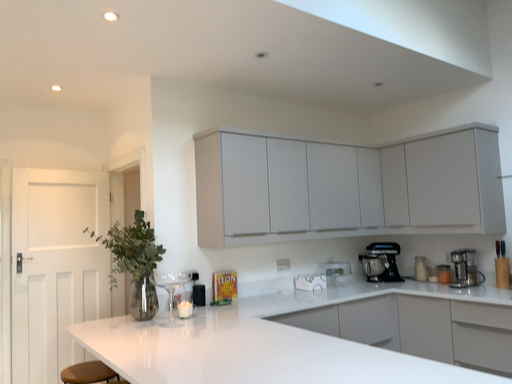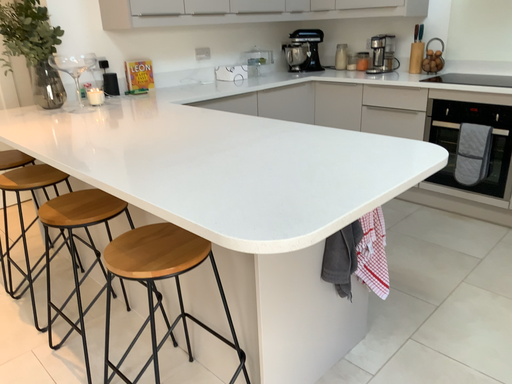
Question: How did the camera likely rotate when shooting the video?

Choices:
 (A) rotated downward
 (B) rotated upward

Answer: (A)